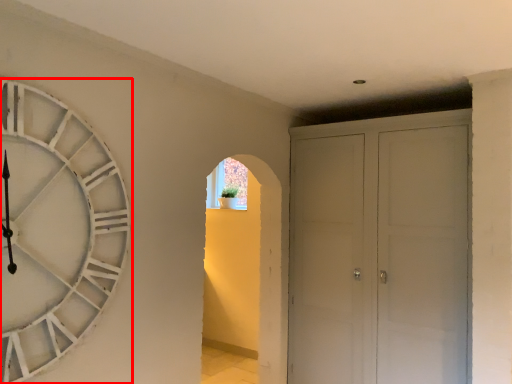
Question: In this image, where is wall clock (annotated by the red box) located relative to door?

Choices:
 (A) left
 (B) right

Answer: (A)